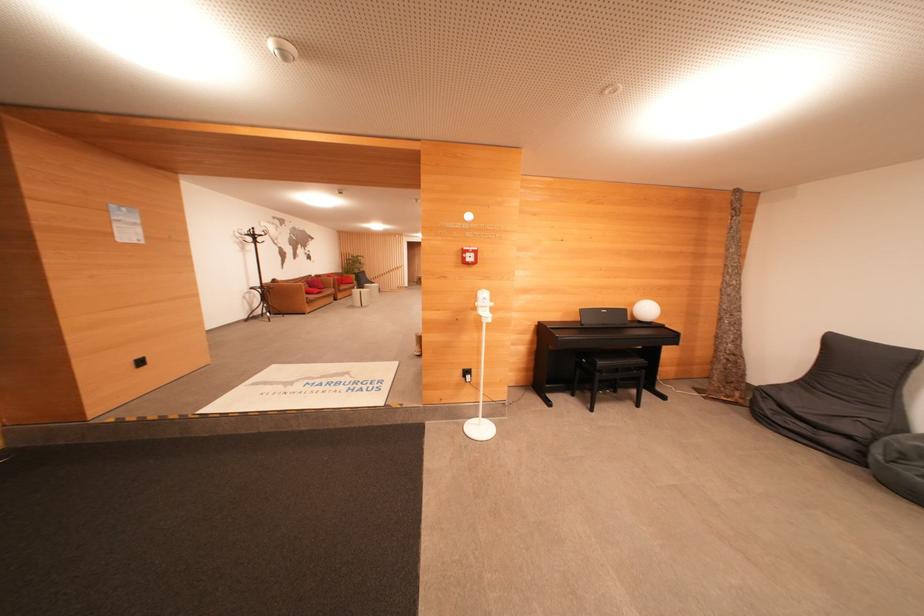
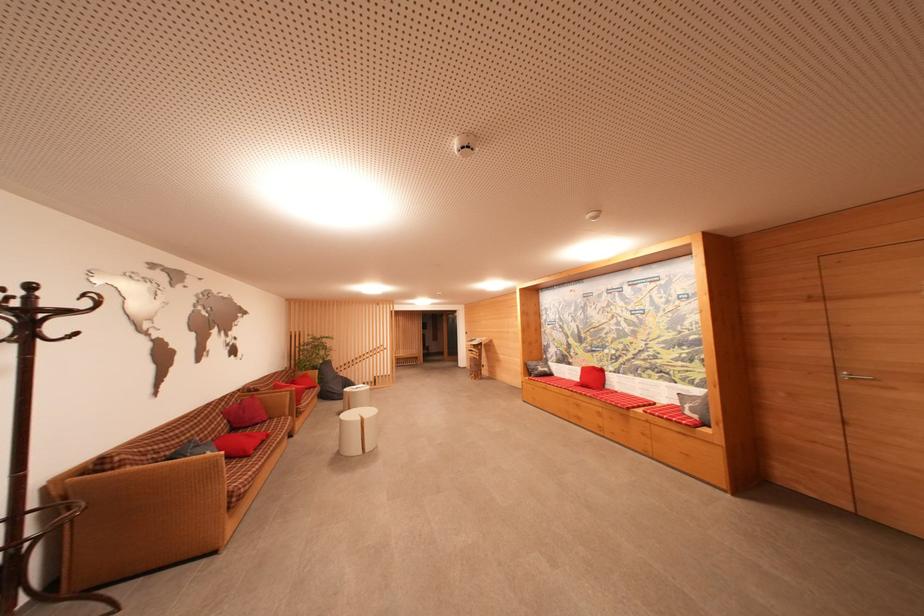
In a continuous first-person perspective shot, in which direction is the camera moving?

The cameraman walked toward left, forward.